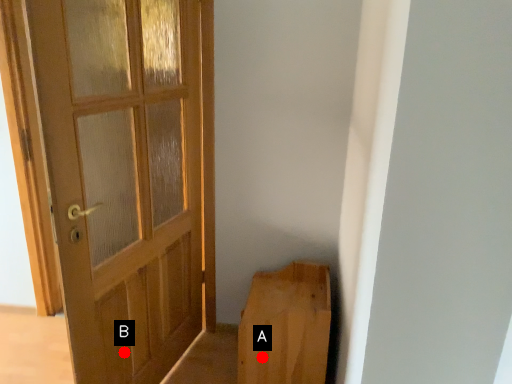
Question: Two points are circled on the image, labeled by A and B beside each circle. Among these points, which one is nearest to the camera?

Choices:
 (A) A is closer
 (B) B is closer

Answer: (B)